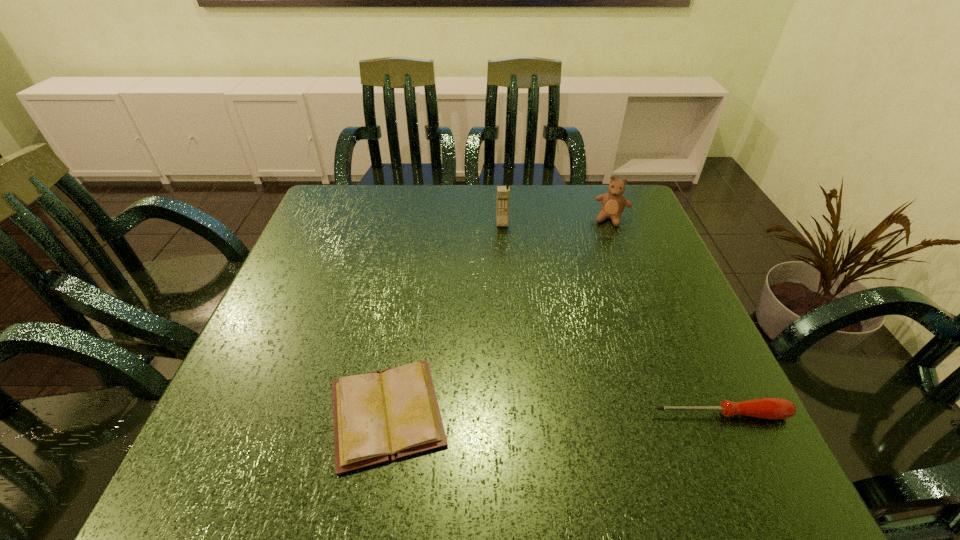
The width and height of the screenshot is (960, 540). I want to click on empty space that is in between the screwdriver and the second tallest object, so click(666, 316).

The image size is (960, 540). I want to click on vacant space that's between the third shortest object and the second shortest object, so click(666, 316).

In order to click on vacant space in between the third object from right to left and the third shortest object in this screenshot , I will do click(557, 221).

Image resolution: width=960 pixels, height=540 pixels. What are the coordinates of `free space between the third shortest object and the diary` in the screenshot? It's located at (499, 316).

You are a GUI agent. You are given a task and a screenshot of the screen. Output one action in this format:
    pyautogui.click(x=<x>, y=<y>)
    Task: Click on the free space between the leftmost object and the teddy bear
    The width and height of the screenshot is (960, 540).
    Given the screenshot: What is the action you would take?
    click(499, 316)

Select which object is the third closest to the teddy bear. Please provide its 2D coordinates. Your answer should be formatted as a tuple, i.e. [(x, y)], where the tuple contains the x and y coordinates of a point satisfying the conditions above.

[(383, 416)]

Identify which object is the second closest to the second tallest object. Please provide its 2D coordinates. Your answer should be formatted as a tuple, i.e. [(x, y)], where the tuple contains the x and y coordinates of a point satisfying the conditions above.

[(772, 408)]

Identify the location of free space that satisfies the following two spatial constraints: 1. on the back side of the third shortest object; 2. on the left side of the cellular telephone. (502, 219).

The image size is (960, 540). What are the coordinates of `vacant space that satisfies the following two spatial constraints: 1. on the back side of the second tallest object; 2. on the left side of the diary` in the screenshot? It's located at (420, 219).